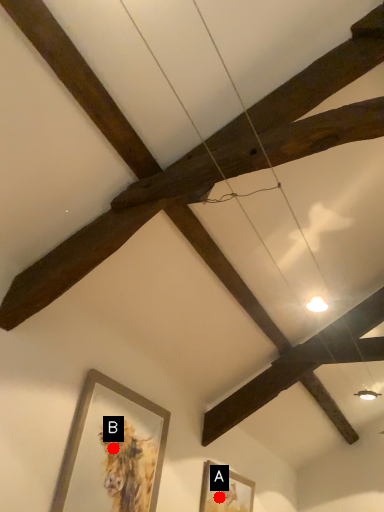
Question: Two points are circled on the image, labeled by A and B beside each circle. Among these points, which one is farthest from the camera?

Choices:
 (A) A is further
 (B) B is further

Answer: (A)